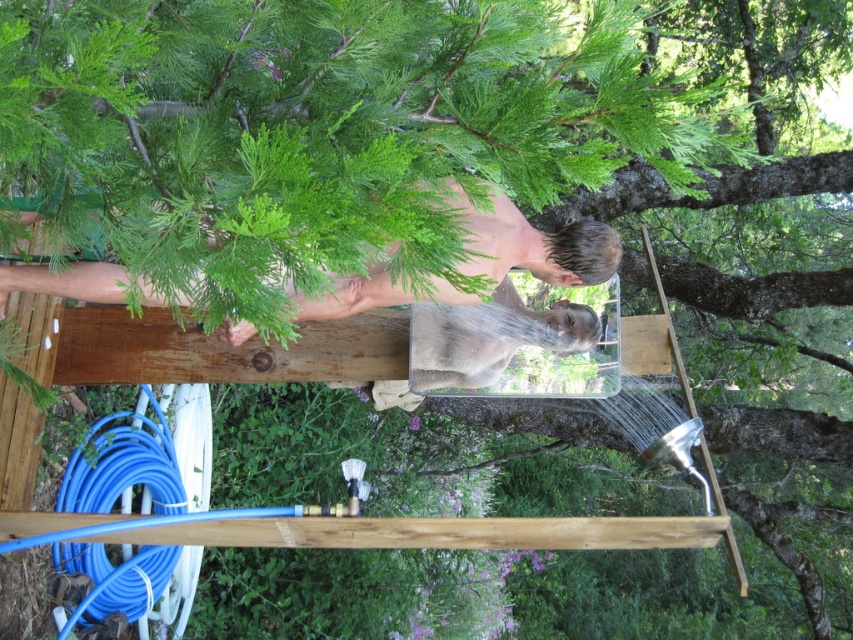
Can you confirm if brown wood beam at center is positioned to the left of smooth skin man at center?

Yes, brown wood beam at center is to the left of smooth skin man at center.

Who is positioned more to the right, brown wood beam at center or smooth skin man at center?

Positioned to the right is smooth skin man at center.

Identify the location of brown wood beam at center. [x=434, y=532].

Where is `brown wood beam at center`? brown wood beam at center is located at coordinates (434, 532).

Who is more forward, (520, 232) or (149, 563)?

Point (520, 232)

Does point (445, 289) lie behind point (151, 394)?

No.

Where is `smooth skin man at center`? The height and width of the screenshot is (640, 853). smooth skin man at center is located at coordinates (534, 244).

Can you confirm if brown wood beam at center is positioned to the right of blue rubber hose at lower left?

Yes, brown wood beam at center is to the right of blue rubber hose at lower left.

Between brown wood beam at center and blue rubber hose at lower left, which one is positioned lower?

blue rubber hose at lower left

Identify the location of brown wood beam at center. (434, 532).